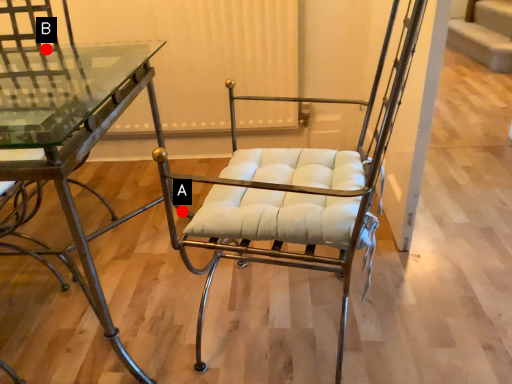
Question: Two points are circled on the image, labeled by A and B beside each circle. Which point is closer to the camera?

Choices:
 (A) A is closer
 (B) B is closer

Answer: (A)